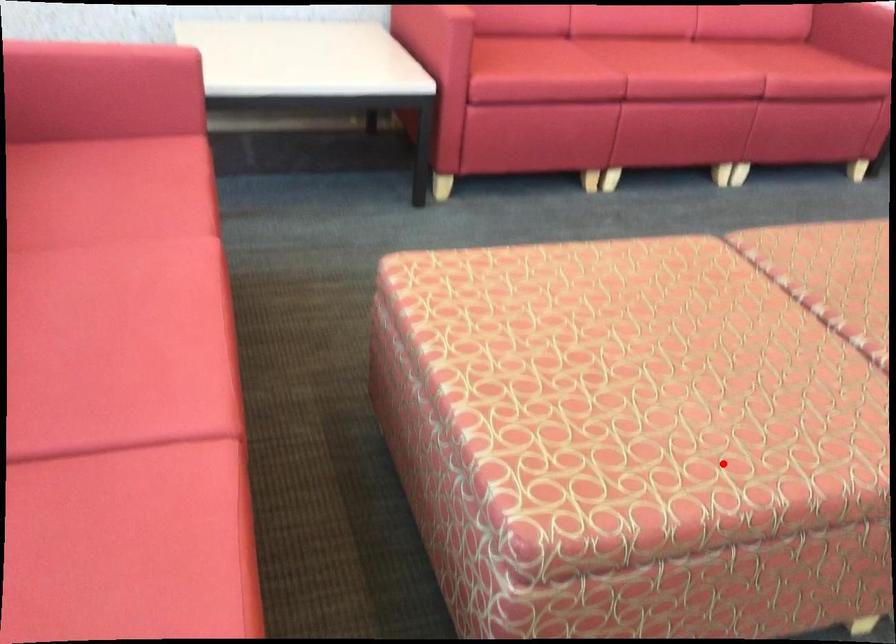
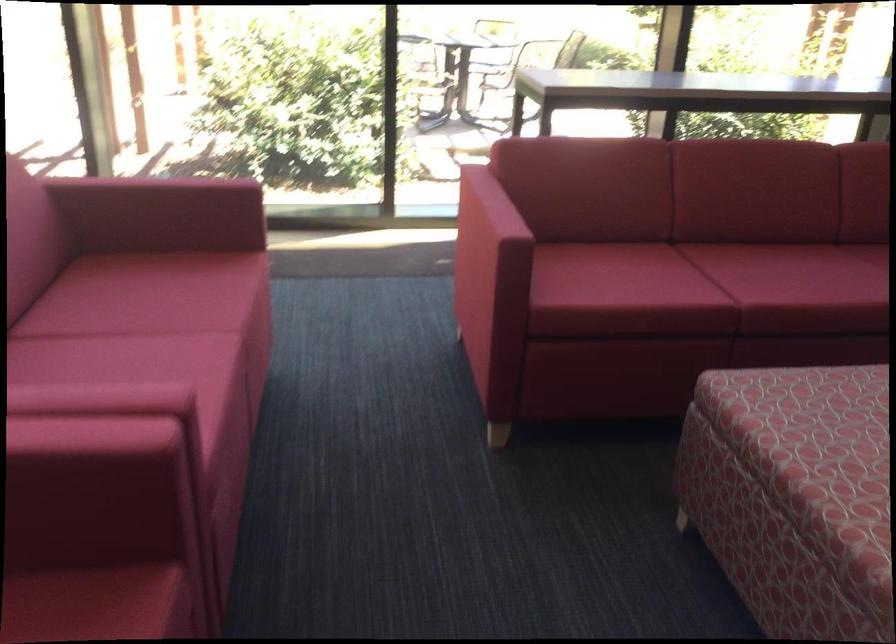
Question: I am providing you with two images of the same scene from different viewpoints. A red point is shown in image1. For the corresponding object point in image2, is it positioned nearer or farther from the camera?

Choices:
 (A) Nearer
 (B) Farther

Answer: (B)